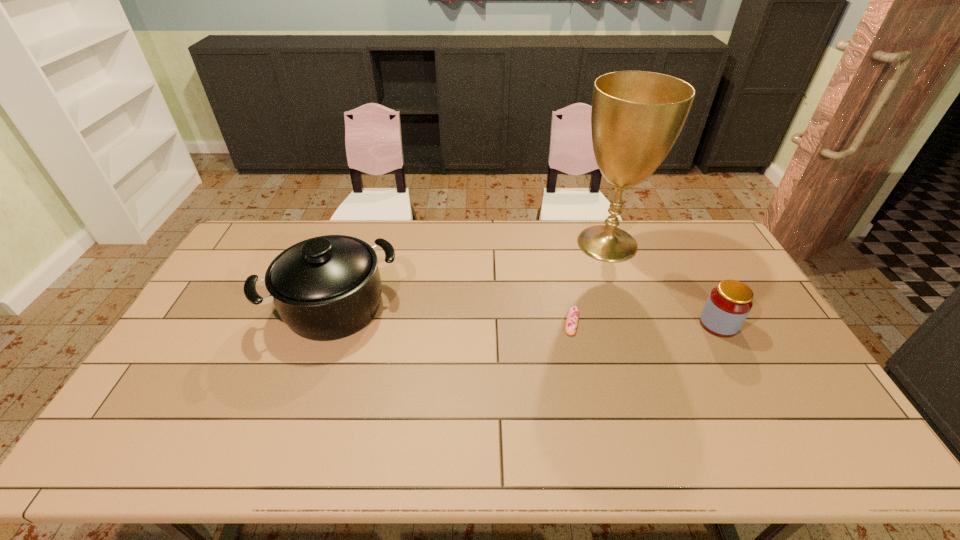
Image resolution: width=960 pixels, height=540 pixels. I want to click on object that is the closest to the shortest object, so click(x=636, y=117).